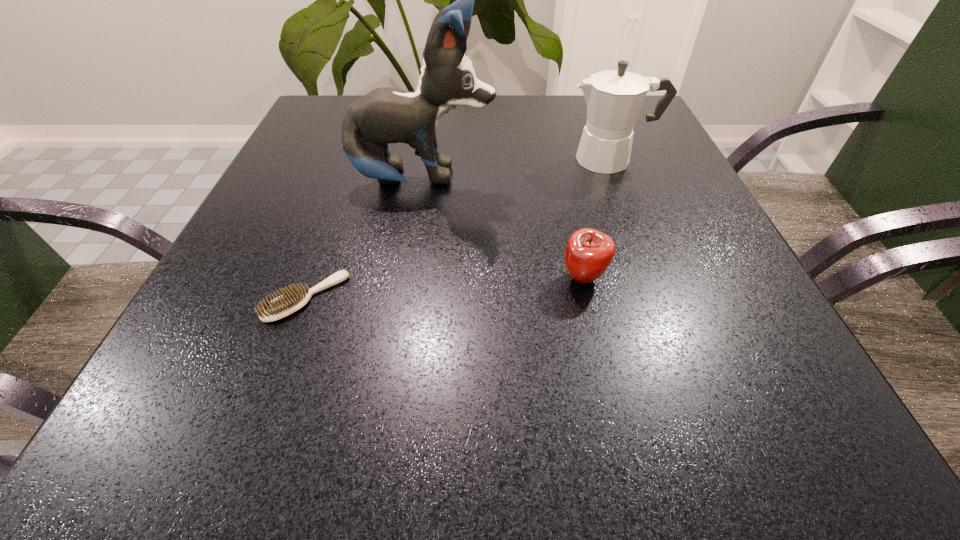
You are a GUI agent. You are given a task and a screenshot of the screen. Output one action in this format:
    pyautogui.click(x=<x>, y=<y>)
    Task: Click on the free space in the image that satisfies the following two spatial constraints: 1. on the front-facing side of the puppy; 2. on the right side of the third tallest object
    This screenshot has width=960, height=540.
    Given the screenshot: What is the action you would take?
    pyautogui.click(x=408, y=278)

The width and height of the screenshot is (960, 540). I want to click on vacant region that satisfies the following two spatial constraints: 1. on the front-facing side of the puppy; 2. on the back side of the third tallest object, so coord(408,278).

This screenshot has width=960, height=540. What are the coordinates of `free space that satisfies the following two spatial constraints: 1. on the front-facing side of the puppy; 2. on the back side of the apple` in the screenshot? It's located at (408, 278).

The height and width of the screenshot is (540, 960). In order to click on vacant area that satisfies the following two spatial constraints: 1. on the front-facing side of the puppy; 2. on the right side of the second shortest object in this screenshot , I will do `click(408, 278)`.